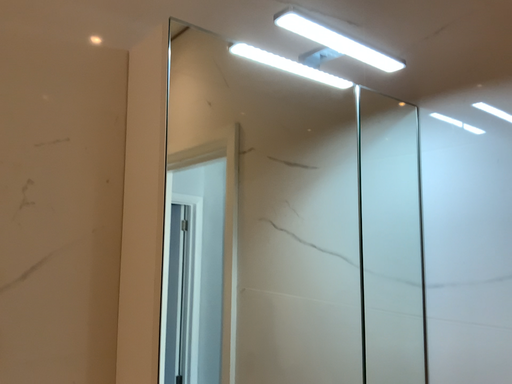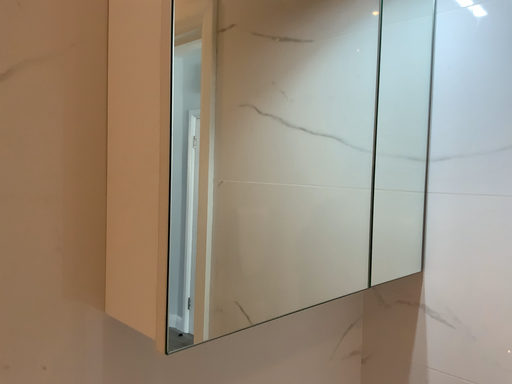
Question: How did the camera likely rotate when shooting the video?

Choices:
 (A) rotated downward
 (B) rotated upward

Answer: (A)